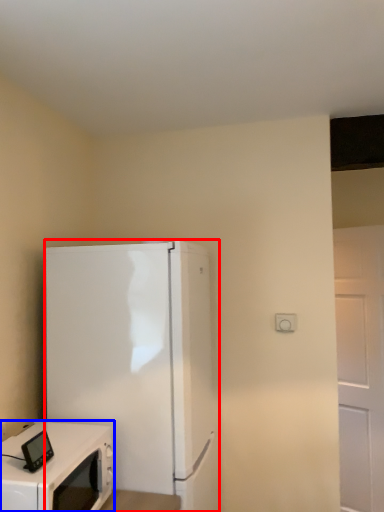
Question: Among these objects, which one is nearest to the camera, refrigerator (highlighted by a red box) or home appliance (highlighted by a blue box)?

Choices:
 (A) refrigerator
 (B) home appliance

Answer: (B)